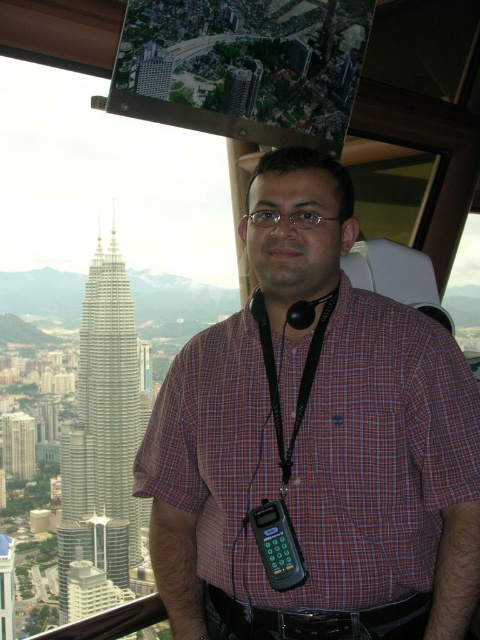
Question: Based on their relative distances, which object is farther from the black fabric lanyard at center?

Choices:
 (A) black plastic phone at center
 (B) silver/glassy twin towers at left
 (C) green glass building at left

Answer: (C)

Question: Which object is the closest to the black fabric lanyard at center?

Choices:
 (A) silver/glassy twin towers at left
 (B) green glass building at left

Answer: (A)

Question: Does silver/glassy twin towers at left have a smaller size compared to black fabric lanyard at center?

Choices:
 (A) yes
 (B) no

Answer: (B)

Question: Is plaid shirt at center closer to camera compared to black plastic phone at center?

Choices:
 (A) no
 (B) yes

Answer: (B)

Question: Among these points, which one is nearest to the camera?

Choices:
 (A) (280, 536)
 (B) (254, 296)
 (C) (440, 493)

Answer: (C)

Question: From the image, what is the correct spatial relationship of silver/glassy twin towers at left in relation to black plastic phone at center?

Choices:
 (A) below
 (B) above

Answer: (B)